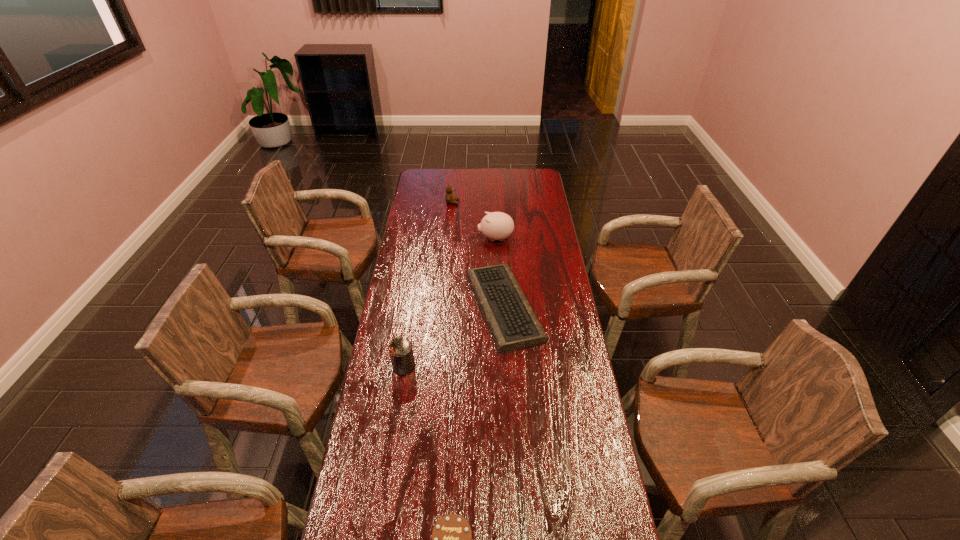
The width and height of the screenshot is (960, 540). In order to click on vacant region that satisfies the following two spatial constraints: 1. at the snout of the piggy bank; 2. on the back side of the computer keyboard in this screenshot , I will do `click(498, 307)`.